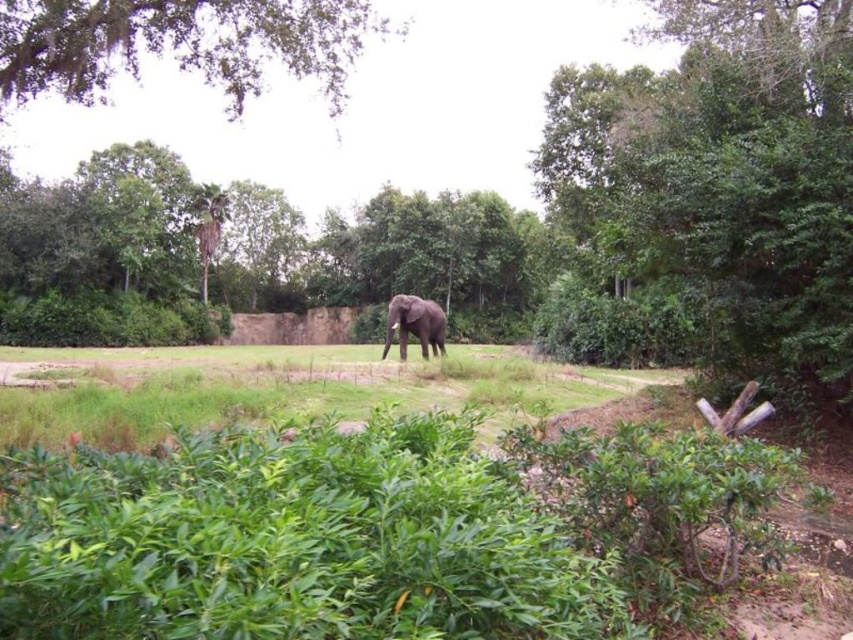
Question: Can you confirm if green grass at center is bigger than gray matte elephant at center?

Choices:
 (A) yes
 (B) no

Answer: (A)

Question: Estimate the real-world distances between objects in this image. Which object is farther from the green grass at center?

Choices:
 (A) green leafy tree at upper left
 (B) green leafy tree at right
 (C) gray matte elephant at center

Answer: (A)

Question: Which object is positioned farthest from the green grass at center?

Choices:
 (A) green leafy tree at upper left
 (B) green leafy tree at right
 (C) gray matte elephant at center

Answer: (A)

Question: Can you confirm if green grass at center is positioned to the right of gray matte elephant at center?

Choices:
 (A) no
 (B) yes

Answer: (A)

Question: Among these objects, which one is farthest from the camera?

Choices:
 (A) gray matte elephant at center
 (B) green grass at center
 (C) green leafy tree at right

Answer: (A)

Question: From the image, what is the correct spatial relationship of green leafy tree at right in relation to gray matte elephant at center?

Choices:
 (A) below
 (B) above

Answer: (B)